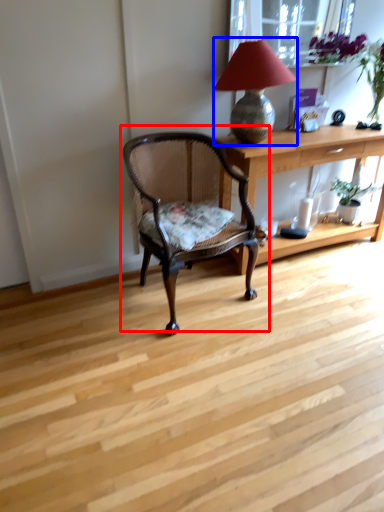
Question: Among these objects, which one is farthest to the camera, chair (highlighted by a red box) or lamp (highlighted by a blue box)?

Choices:
 (A) chair
 (B) lamp

Answer: (B)